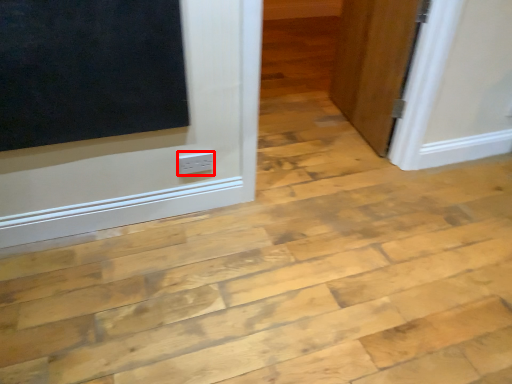
Question: From the image's perspective, what is the correct spatial positioning of electric outlet (annotated by the red box) in reference to door?

Choices:
 (A) below
 (B) above

Answer: (A)